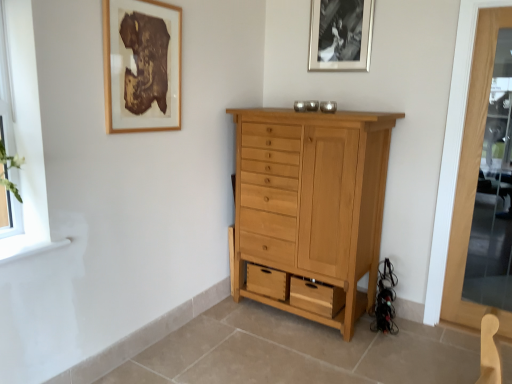
Where is `natural wood cabinet at center`? natural wood cabinet at center is located at coordinates (312, 201).

What do you see at coordinates (340, 35) in the screenshot? The height and width of the screenshot is (384, 512). I see `black matte picture frame at upper center, which is counted as the 1th picture frame, starting from the right` at bounding box center [340, 35].

At what (x,y) coordinates should I click in order to perform the action: click on wooden picture frame at upper left, which appears as the 2th picture frame when viewed from the back. Please return your answer as a coordinate pair (x, y). The image size is (512, 384). Looking at the image, I should click on (142, 66).

Between transparent glass screen door at right and clear glass window at left, which one has less height?

With less height is clear glass window at left.

Considering the relative sizes of transparent glass screen door at right and clear glass window at left in the image provided, is transparent glass screen door at right wider than clear glass window at left?

Yes.

Looking at this image, how distant is transparent glass screen door at right from clear glass window at left?

transparent glass screen door at right and clear glass window at left are 8.05 feet apart.

How distant is transparent glass screen door at right from natural wood cabinet at center?

They are 31.62 inches apart.

Is transparent glass screen door at right at the right side of natural wood cabinet at center?

Yes.

Where is `screen door lying in front of the natural wood cabinet at center`? screen door lying in front of the natural wood cabinet at center is located at coordinates coord(465,161).

Considering the sizes of objects transparent glass screen door at right and natural wood cabinet at center in the image provided, who is wider, transparent glass screen door at right or natural wood cabinet at center?

natural wood cabinet at center is wider.

Would you consider transparent glass screen door at right to be distant from wooden picture frame at upper left, the 1th picture frame when ordered from front to back?

Absolutely, transparent glass screen door at right is distant from wooden picture frame at upper left, the 1th picture frame when ordered from front to back.

Between transparent glass screen door at right and wooden picture frame at upper left, positioned as the 1th picture frame in left-to-right order, which one has larger width?

With larger width is transparent glass screen door at right.

How distant is transparent glass screen door at right from wooden picture frame at upper left, the 1th picture frame when ordered from front to back?

transparent glass screen door at right is 5.88 feet away from wooden picture frame at upper left, the 1th picture frame when ordered from front to back.

Which of these two, transparent glass screen door at right or wooden picture frame at upper left, which appears as the 2th picture frame when viewed from the back, stands taller?

Standing taller between the two is transparent glass screen door at right.

Is transparent glass screen door at right located outside black matte picture frame at upper center, which is the 1th picture frame in back-to-front order?

Absolutely, transparent glass screen door at right is external to black matte picture frame at upper center, which is the 1th picture frame in back-to-front order.

Is point (452, 92) less distant than point (353, 44)?

That is True.

From a real-world perspective, is transparent glass screen door at right located higher than black matte picture frame at upper center, which is counted as the second picture frame, starting from the left?

No, from a real-world perspective, transparent glass screen door at right is not on top of black matte picture frame at upper center, which is counted as the second picture frame, starting from the left.

You are a GUI agent. You are given a task and a screenshot of the screen. Output one action in this format:
    pyautogui.click(x=<x>, y=<y>)
    Task: Click on the window in front of the black matte picture frame at upper center, which is counted as the 1th picture frame, starting from the right
    Image resolution: width=512 pixels, height=384 pixels.
    Given the screenshot: What is the action you would take?
    pyautogui.click(x=6, y=90)

Is clear glass window at left in front of or behind black matte picture frame at upper center, which is counted as the second picture frame, starting from the left, in the image?

clear glass window at left is in front of black matte picture frame at upper center, which is counted as the second picture frame, starting from the left.

From a real-world perspective, which object rests below the other?

clear glass window at left is physically lower.

Is clear glass window at left at the right side of black matte picture frame at upper center, which appears as the 2th picture frame when viewed from the front?

Incorrect, clear glass window at left is not on the right side of black matte picture frame at upper center, which appears as the 2th picture frame when viewed from the front.

How much distance is there between wooden picture frame at upper left, positioned as the 1th picture frame in left-to-right order, and clear glass window at left?

wooden picture frame at upper left, positioned as the 1th picture frame in left-to-right order, is 23.33 inches away from clear glass window at left.

Based on the photo, from the image's perspective, which is above, wooden picture frame at upper left, placed as the 2th picture frame when sorted from right to left, or clear glass window at left?

wooden picture frame at upper left, placed as the 2th picture frame when sorted from right to left, from the image's perspective.

Which object is further away from the camera taking this photo, wooden picture frame at upper left, the 1th picture frame when ordered from front to back, or clear glass window at left?

wooden picture frame at upper left, the 1th picture frame when ordered from front to back, is behind.

From a real-world perspective, is black matte picture frame at upper center, which is counted as the 1th picture frame, starting from the right, located higher than wooden picture frame at upper left, positioned as the 1th picture frame in left-to-right order?

Yes, from a real-world perspective, black matte picture frame at upper center, which is counted as the 1th picture frame, starting from the right, is above wooden picture frame at upper left, positioned as the 1th picture frame in left-to-right order.

Is black matte picture frame at upper center, which appears as the 2th picture frame when viewed from the front, completely or partially outside of wooden picture frame at upper left, positioned as the 1th picture frame in left-to-right order?

Yes, black matte picture frame at upper center, which appears as the 2th picture frame when viewed from the front, is located beyond the bounds of wooden picture frame at upper left, positioned as the 1th picture frame in left-to-right order.

Between black matte picture frame at upper center, which is counted as the 1th picture frame, starting from the right, and wooden picture frame at upper left, which appears as the 2th picture frame when viewed from the back, which one is positioned in front?

Positioned in front is wooden picture frame at upper left, which appears as the 2th picture frame when viewed from the back.

Does black matte picture frame at upper center, which is counted as the second picture frame, starting from the left, appear on the right side of wooden picture frame at upper left, positioned as the 1th picture frame in left-to-right order?

Yes, black matte picture frame at upper center, which is counted as the second picture frame, starting from the left, is to the right of wooden picture frame at upper left, positioned as the 1th picture frame in left-to-right order.

Where is `window lying on the left of transparent glass screen door at right`? window lying on the left of transparent glass screen door at right is located at coordinates (6, 90).

This screenshot has width=512, height=384. In order to click on chest of drawers below the transparent glass screen door at right (from a real-world perspective) in this screenshot , I will do `click(312, 201)`.

In the scene shown: Which object lies further to the anchor point black matte picture frame at upper center, which appears as the 2th picture frame when viewed from the front, wooden picture frame at upper left, placed as the 2th picture frame when sorted from right to left, or transparent glass screen door at right?

wooden picture frame at upper left, placed as the 2th picture frame when sorted from right to left, lies further to black matte picture frame at upper center, which appears as the 2th picture frame when viewed from the front, than the other object.

When comparing their distances from black matte picture frame at upper center, which is counted as the second picture frame, starting from the left, does natural wood cabinet at center or transparent glass screen door at right seem further?

natural wood cabinet at center is further to black matte picture frame at upper center, which is counted as the second picture frame, starting from the left.

Looking at the image, which one is located closer to clear glass window at left, black matte picture frame at upper center, which is counted as the second picture frame, starting from the left, or wooden picture frame at upper left, which appears as the 2th picture frame when viewed from the back?

wooden picture frame at upper left, which appears as the 2th picture frame when viewed from the back.

Looking at the image, which one is located further to natural wood cabinet at center, black matte picture frame at upper center, which appears as the 2th picture frame when viewed from the front, or wooden picture frame at upper left, the 1th picture frame when ordered from front to back?

wooden picture frame at upper left, the 1th picture frame when ordered from front to back, is further to natural wood cabinet at center.

From the image, which object appears to be nearer to clear glass window at left, wooden picture frame at upper left, positioned as the 1th picture frame in left-to-right order, or black matte picture frame at upper center, which appears as the 2th picture frame when viewed from the front?

The object closer to clear glass window at left is wooden picture frame at upper left, positioned as the 1th picture frame in left-to-right order.

Based on their spatial positions, is transparent glass screen door at right or natural wood cabinet at center closer to black matte picture frame at upper center, which is the 1th picture frame in back-to-front order?

transparent glass screen door at right.

When comparing their distances from clear glass window at left, does black matte picture frame at upper center, which is the 1th picture frame in back-to-front order, or transparent glass screen door at right seem closer?

The object closer to clear glass window at left is black matte picture frame at upper center, which is the 1th picture frame in back-to-front order.

When comparing their distances from black matte picture frame at upper center, which is counted as the 1th picture frame, starting from the right, does transparent glass screen door at right or wooden picture frame at upper left, which appears as the 2th picture frame when viewed from the back, seem closer?

The object closer to black matte picture frame at upper center, which is counted as the 1th picture frame, starting from the right, is transparent glass screen door at right.

In order to click on chest of drawers between clear glass window at left and black matte picture frame at upper center, which appears as the 2th picture frame when viewed from the front, in the horizontal direction in this screenshot , I will do `click(312, 201)`.

Locate an element on the screen. This screenshot has width=512, height=384. picture frame between clear glass window at left and natural wood cabinet at center in the horizontal direction is located at coordinates point(142,66).

Where is `picture frame between wooden picture frame at upper left, positioned as the 1th picture frame in left-to-right order, and transparent glass screen door at right`? Image resolution: width=512 pixels, height=384 pixels. picture frame between wooden picture frame at upper left, positioned as the 1th picture frame in left-to-right order, and transparent glass screen door at right is located at coordinates (340, 35).

Identify the location of picture frame between clear glass window at left and black matte picture frame at upper center, which is the 1th picture frame in back-to-front order, in the horizontal direction. click(142, 66).